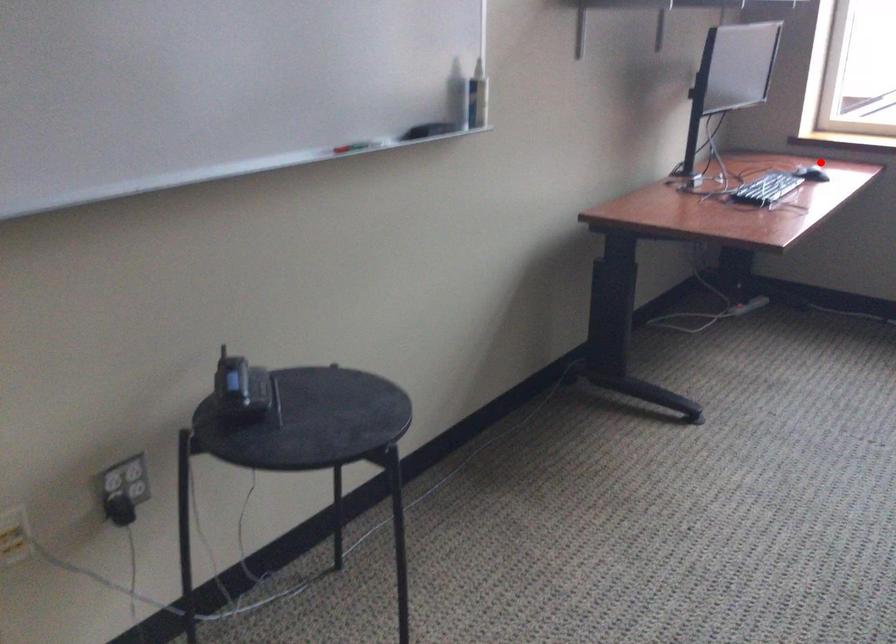
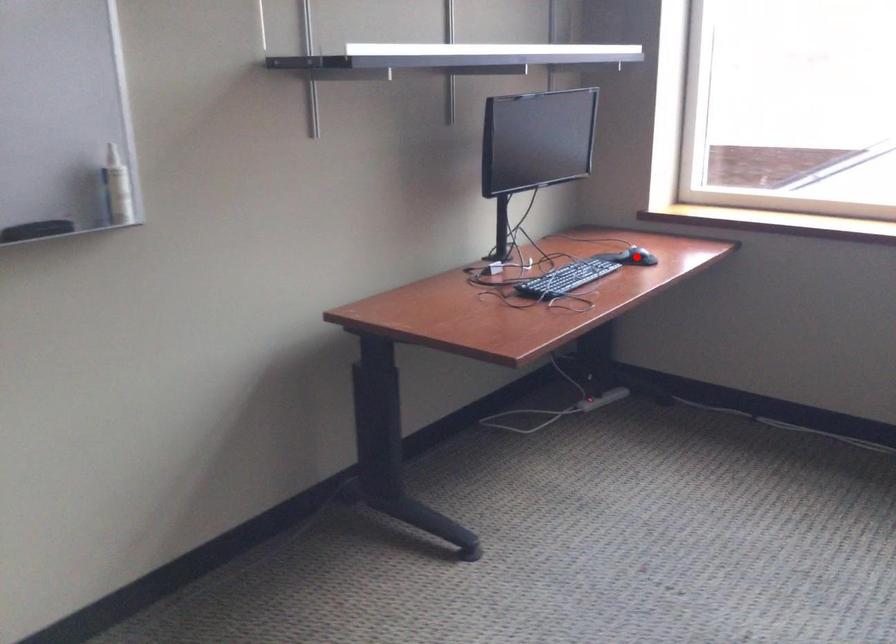
I am providing you with two images of the same scene from different viewpoints. A red point is marked on the first image and another point is marked on the second image. Is the marked point in image1 the same physical position as the marked point in image2?

Yes